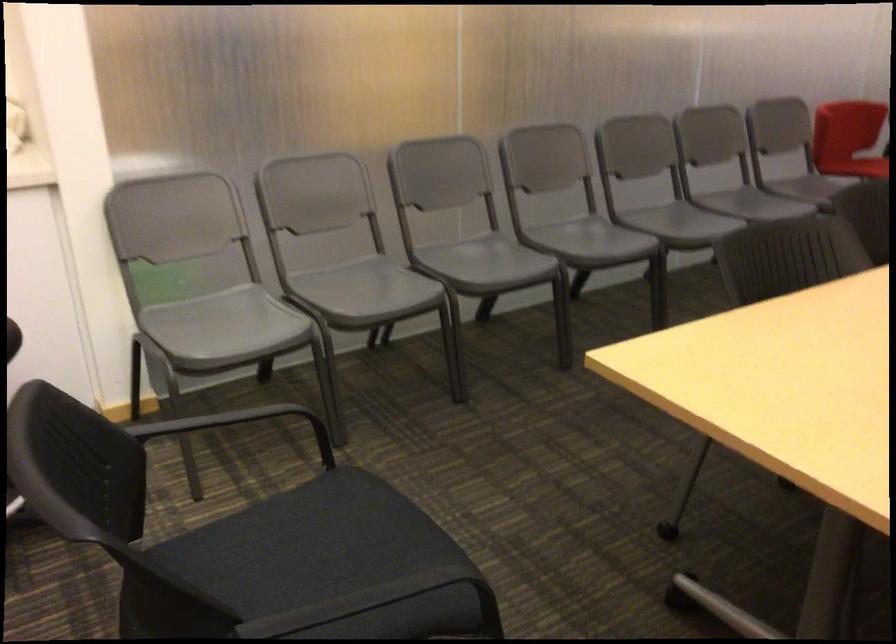
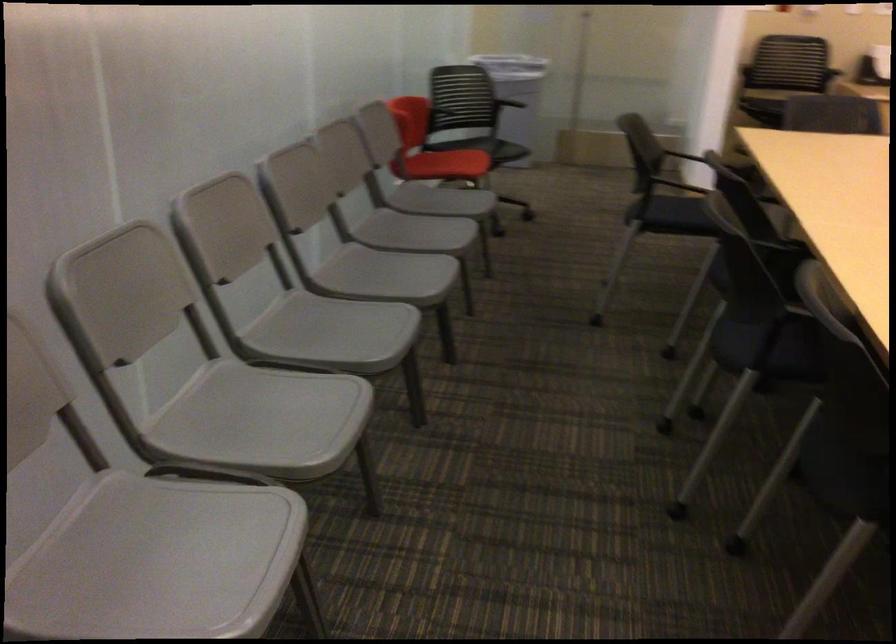
Locate, in the second image, the point that corresponds to (377,283) in the first image.

(158, 561)